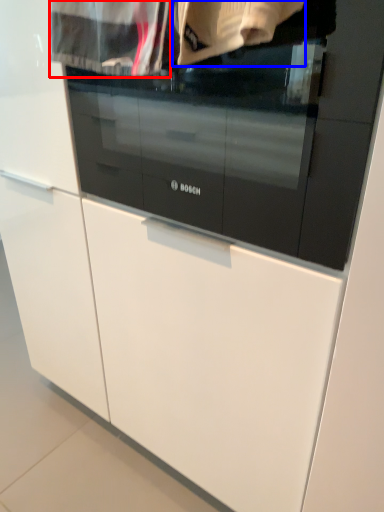
Question: Which object is closer to the camera taking this photo, clothing (highlighted by a red box) or clothing (highlighted by a blue box)?

Choices:
 (A) clothing
 (B) clothing

Answer: (B)